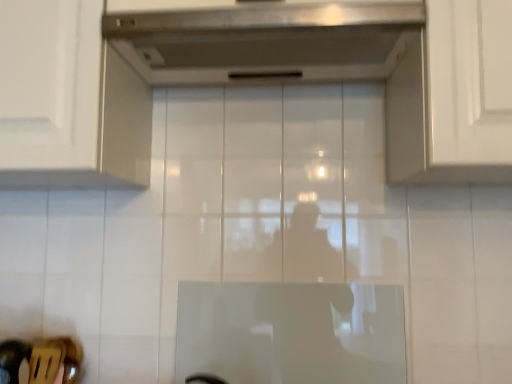
Question: Which direction should I rotate to look at stainless steel exhaust hood at upper center?

Choices:
 (A) left
 (B) right

Answer: (B)